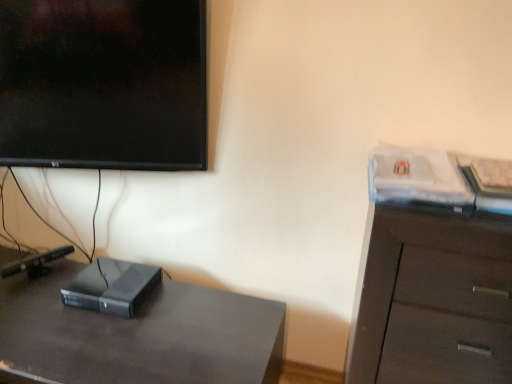
Question: Considering the relative sizes of dark wood cabinet at right and black matte computer at lower left in the image provided, is dark wood cabinet at right taller than black matte computer at lower left?

Choices:
 (A) yes
 (B) no

Answer: (A)

Question: Does dark wood cabinet at right have a smaller size compared to black matte computer at lower left?

Choices:
 (A) no
 (B) yes

Answer: (A)

Question: Would you say dark wood cabinet at right contains black matte computer at lower left?

Choices:
 (A) no
 (B) yes

Answer: (A)

Question: Could you tell me if dark wood cabinet at right is turned towards black matte computer at lower left?

Choices:
 (A) yes
 (B) no

Answer: (B)

Question: From a real-world perspective, is dark wood cabinet at right on black matte computer at lower left?

Choices:
 (A) no
 (B) yes

Answer: (B)

Question: Is dark wood cabinet at right outside black matte computer at lower left?

Choices:
 (A) no
 (B) yes

Answer: (B)

Question: Is black matte computer at lower left positioned in front of black matte desk at lower left?

Choices:
 (A) yes
 (B) no

Answer: (B)

Question: Is black matte computer at lower left not close to black matte desk at lower left?

Choices:
 (A) yes
 (B) no

Answer: (B)

Question: Considering the relative sizes of black matte computer at lower left and black matte desk at lower left in the image provided, is black matte computer at lower left taller than black matte desk at lower left?

Choices:
 (A) yes
 (B) no

Answer: (B)

Question: Does black matte computer at lower left appear on the left side of black matte desk at lower left?

Choices:
 (A) yes
 (B) no

Answer: (B)

Question: Considering the relative positions of black matte computer at lower left and black matte desk at lower left in the image provided, is black matte computer at lower left to the right of black matte desk at lower left from the viewer's perspective?

Choices:
 (A) no
 (B) yes

Answer: (B)

Question: Could you tell me if black matte computer at lower left is facing black matte desk at lower left?

Choices:
 (A) yes
 (B) no

Answer: (B)

Question: Is black matte computer at lower left in front of dark wood cabinet at right?

Choices:
 (A) no
 (B) yes

Answer: (A)